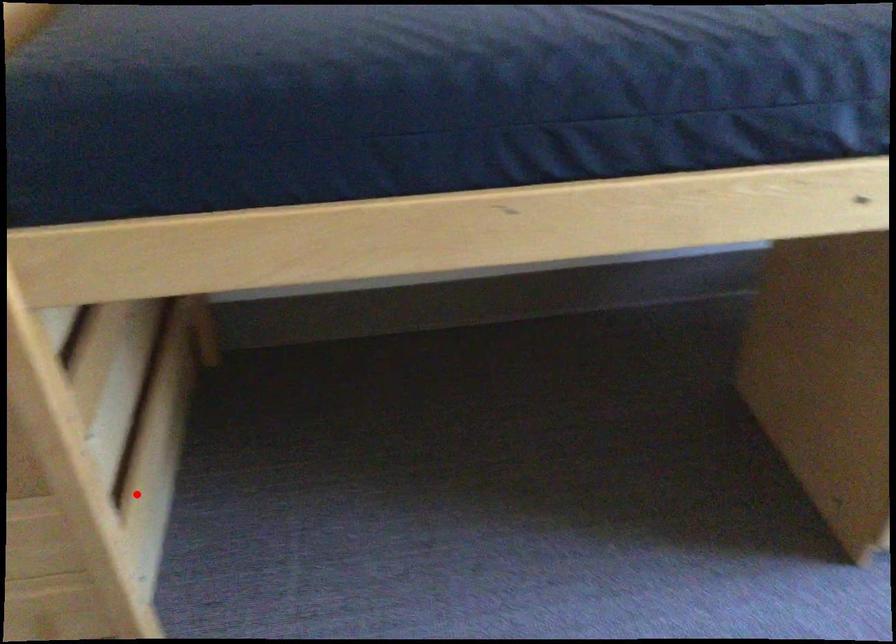
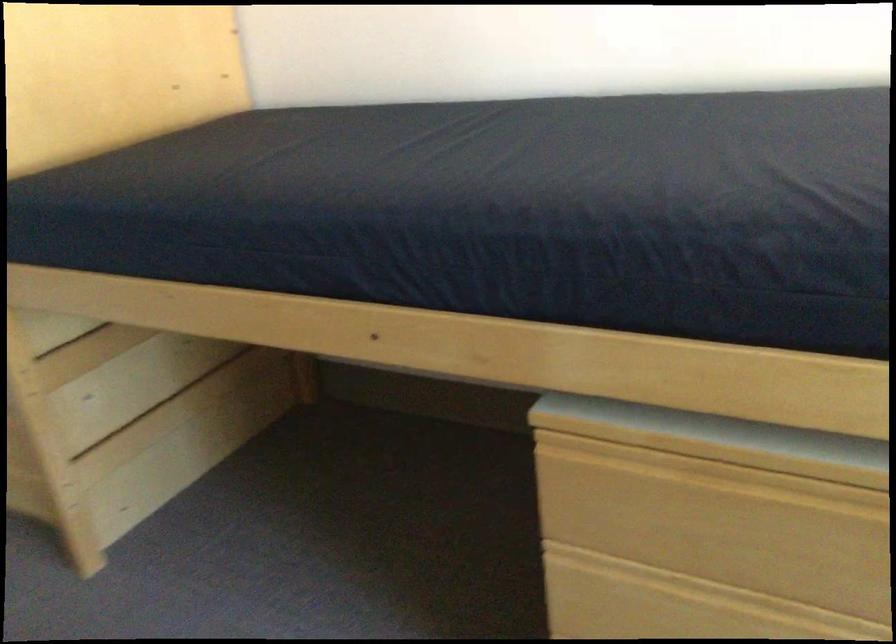
In the second image, find the point that corresponds to the highlighted location in the first image.

(152, 458)